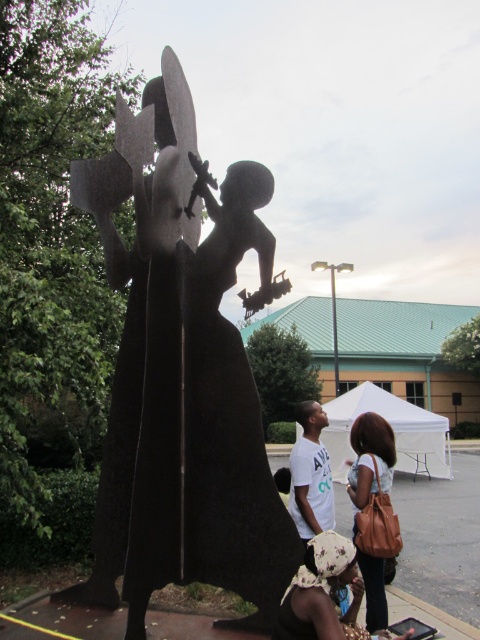
Does black matte sculpture at center have a lesser height compared to white matte shirt at center?

No.

Who is more forward, (168, 524) or (295, 483)?

Positioned in front is point (168, 524).

Is point (157, 269) closer to camera compared to point (319, 509)?

Yes, it is.

Identify the location of black matte sculpture at center. (193, 365).

Is matte brown purse at lower center positioned at the back of white matte shirt at center?

No, matte brown purse at lower center is in front of white matte shirt at center.

Where is `matte brown purse at lower center`? The image size is (480, 640). matte brown purse at lower center is located at coordinates (322, 593).

Between point (408, 636) and point (297, 506), which one is positioned in front?

Point (408, 636)

Identify the location of matte brown purse at lower center. (322, 593).

Does point (358, 525) come farther from viewer compared to point (315, 419)?

No.

Is brown leather purse at lower center bigger than white matte shirt at center?

Yes, brown leather purse at lower center is bigger than white matte shirt at center.

Which is behind, point (359, 493) or point (330, 484)?

The point (330, 484) is more distant.

Find the location of a particular element. brown leather purse at lower center is located at coordinates (373, 509).